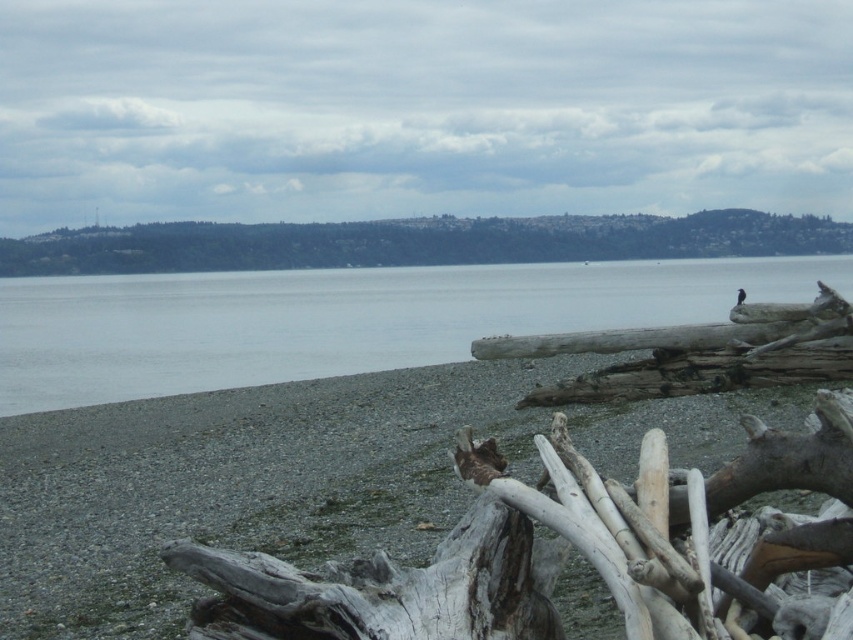
You are a photographer planning to capture the entire scene in one shot. Given that the gray weathered log at right is partially blocking your view of the gray water at center, can you adjust your position to ensure both objects are fully visible without any obstruction?

The gray water at center is larger in size than the gray weathered log at right. Since the log is smaller and only partially blocking the view, you can adjust your position slightly to the left or right to ensure both objects are fully visible without obstruction.

You are standing on the pebble beach and see two points marked in the image. The first point is at coordinate point (517,292) and the second is at point (720,337). Which point is closer to you?

Point (720,337) is closer to you because it is in front of point (517,292).

You are a hiker who wants to cross from the beach to the gray weathered log at right without getting your shoes wet. The gray water at center is calm but covers the path. Given that you can jump 2 meters, can you make it across the 16.27 meters gap between them?

The distance between the gray water at center and the gray weathered log at right is 16.27 meters. Since you can only jump 2 meters, you cannot make it across the gap without getting your shoes wet.